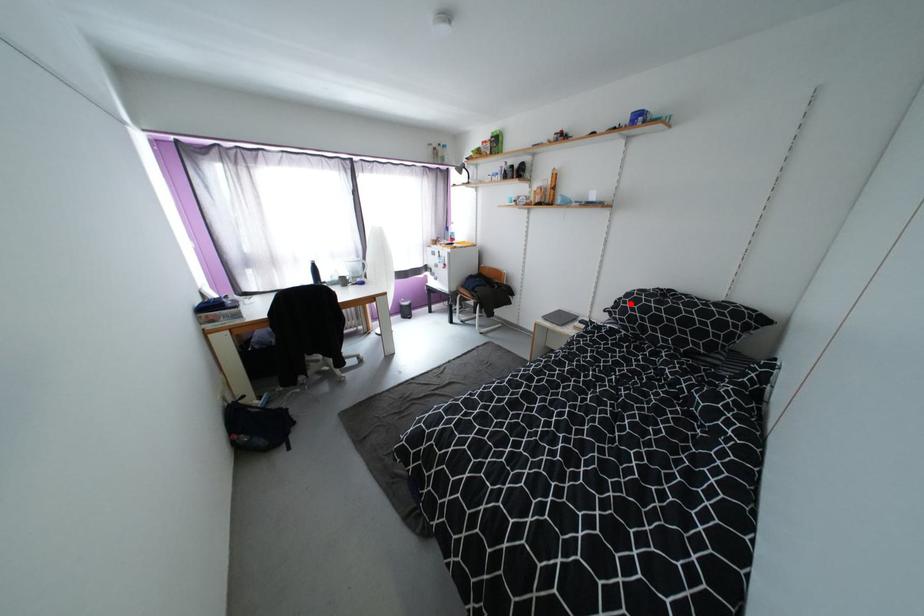
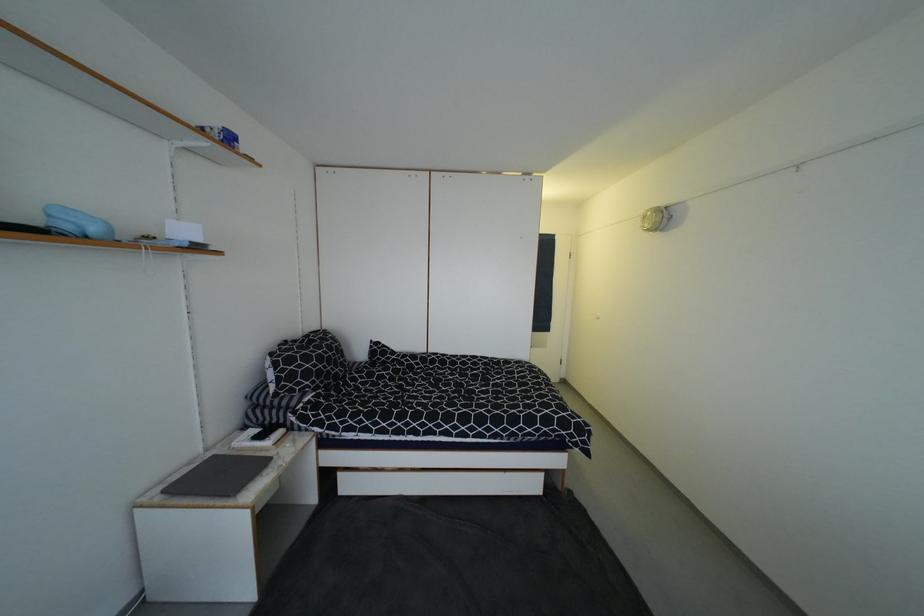
Question: I am providing you with two images of the same scene from different viewpoints. Image1 has a red point marked. In image2, the corresponding 3D location appears at what relative position? Reply with the corresponding letter.

Choices:
 (A) Closer
 (B) Farther

Answer: (B)